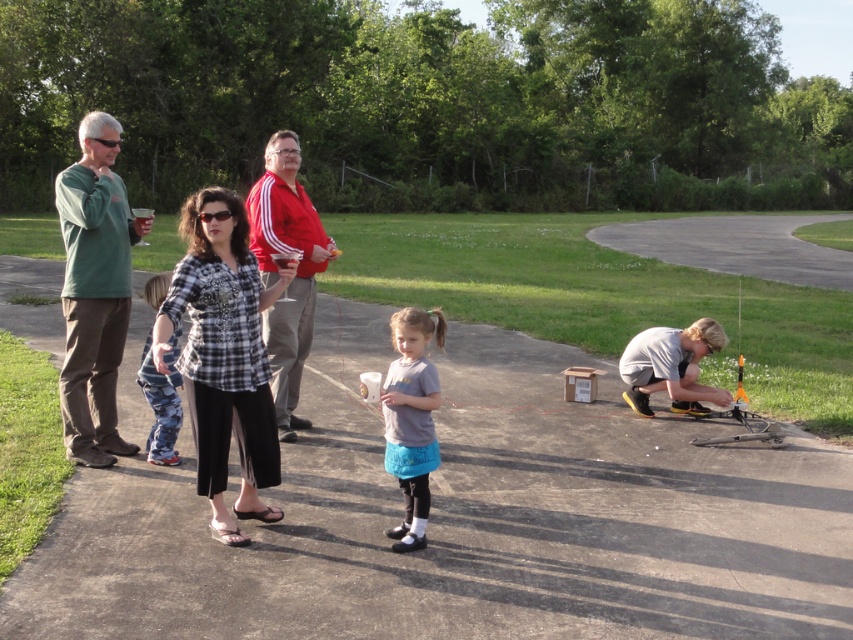
You are a photographer trying to capture a group photo of the gray matte shirt at center and the camouflage pants at left. Since you want to ensure both subjects are in focus, you need to know their heights. Which subject should you adjust your camera focus for first based on their height?

The gray matte shirt at center is taller than the camouflage pants at left, so you should adjust the camera focus for the gray matte shirt at center first as it is taller.

You are a delivery person carrying a box that is 3 meters long. You need to place it between the green matte shirt at left and the gray matte shirt at center. Is there enough space between them to fit the box?

The distance between the green matte shirt at left and the gray matte shirt at center is 2.74 meters. Since the box is 3 meters long, it is slightly longer than the available space. Therefore, the box cannot be placed between them without overlapping.